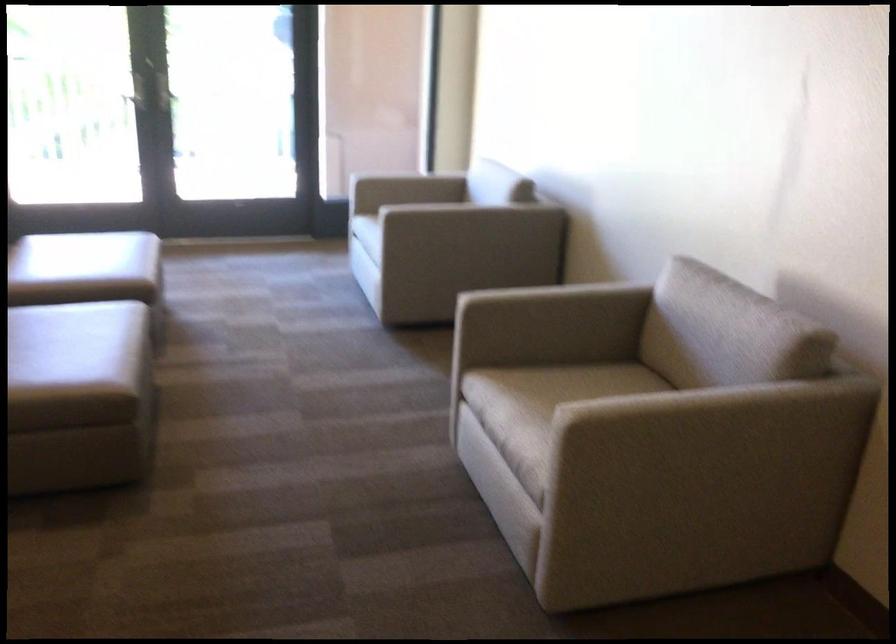
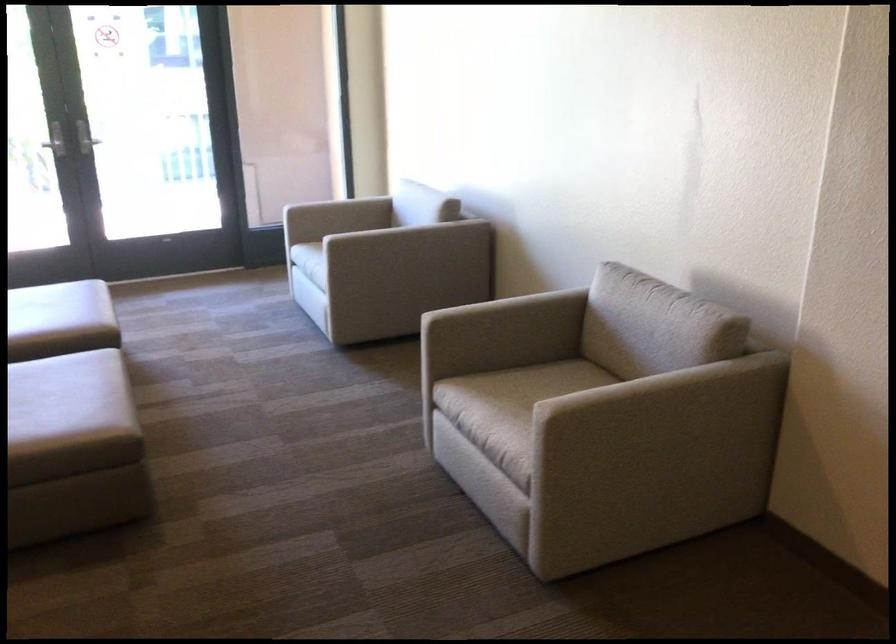
The point at [479,223] is marked in the first image. Where is the corresponding point in the second image?

(417, 242)